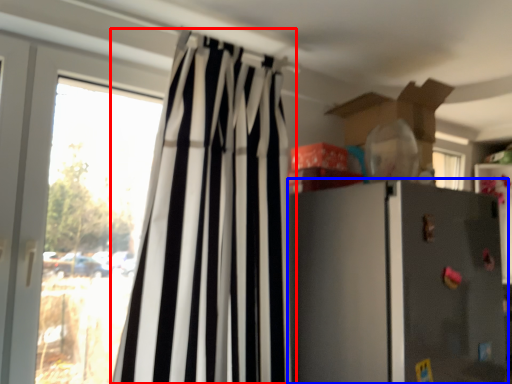
Question: Among these objects, which one is nearest to the camera, curtain (highlighted by a red box) or refrigerator (highlighted by a blue box)?

Choices:
 (A) curtain
 (B) refrigerator

Answer: (A)